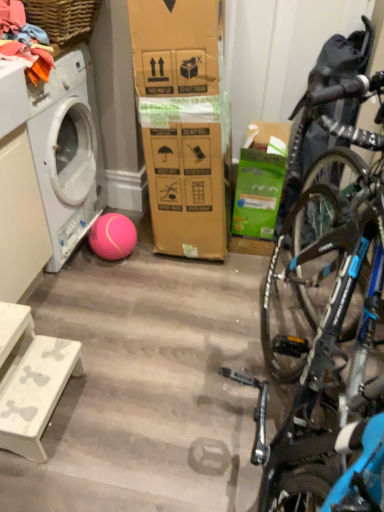
Question: Considering the relative sizes of soft cotton clothes at upper left and woven wood picnic basket at upper left in the image provided, is soft cotton clothes at upper left bigger than woven wood picnic basket at upper left?

Choices:
 (A) no
 (B) yes

Answer: (B)

Question: Is soft cotton clothes at upper left shorter than woven wood picnic basket at upper left?

Choices:
 (A) no
 (B) yes

Answer: (A)

Question: Can you confirm if soft cotton clothes at upper left is positioned to the left of woven wood picnic basket at upper left?

Choices:
 (A) yes
 (B) no

Answer: (A)

Question: From a real-world perspective, is soft cotton clothes at upper left physically below woven wood picnic basket at upper left?

Choices:
 (A) no
 (B) yes

Answer: (B)

Question: Is soft cotton clothes at upper left looking in the opposite direction of woven wood picnic basket at upper left?

Choices:
 (A) yes
 (B) no

Answer: (B)

Question: In the image, is white marble step stool at lower left positioned in front of or behind soft cotton clothes at upper left?

Choices:
 (A) front
 (B) behind

Answer: (A)

Question: Considering the relative positions of white marble step stool at lower left and soft cotton clothes at upper left in the image provided, is white marble step stool at lower left to the left or to the right of soft cotton clothes at upper left?

Choices:
 (A) left
 (B) right

Answer: (B)

Question: From a real-world perspective, is white marble step stool at lower left physically located above or below soft cotton clothes at upper left?

Choices:
 (A) below
 (B) above

Answer: (A)

Question: Is white marble step stool at lower left situated inside soft cotton clothes at upper left or outside?

Choices:
 (A) outside
 (B) inside

Answer: (A)

Question: Is soft cotton clothes at upper left in front of or behind white matte washing machine at left in the image?

Choices:
 (A) behind
 (B) front

Answer: (B)

Question: In terms of size, does soft cotton clothes at upper left appear bigger or smaller than white matte washing machine at left?

Choices:
 (A) small
 (B) big

Answer: (A)

Question: Does point (34, 65) appear closer or farther from the camera than point (92, 101)?

Choices:
 (A) closer
 (B) farther

Answer: (A)

Question: Considering the relative positions of soft cotton clothes at upper left and white matte washing machine at left in the image provided, is soft cotton clothes at upper left to the left or to the right of white matte washing machine at left?

Choices:
 (A) left
 (B) right

Answer: (B)

Question: From the image's perspective, is woven wood picnic basket at upper left positioned above or below soft cotton clothes at upper left?

Choices:
 (A) above
 (B) below

Answer: (A)

Question: In the image, is woven wood picnic basket at upper left positioned in front of or behind soft cotton clothes at upper left?

Choices:
 (A) behind
 (B) front

Answer: (A)